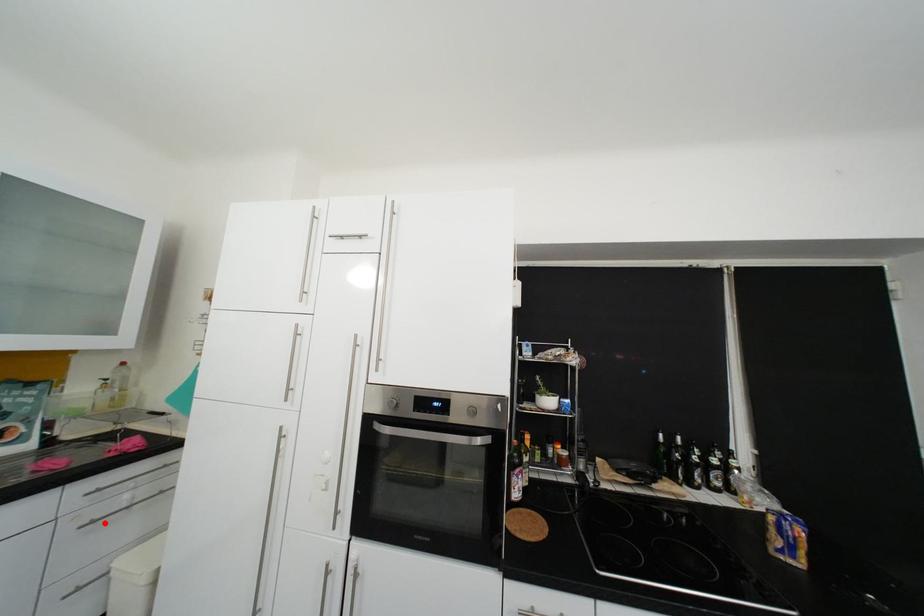
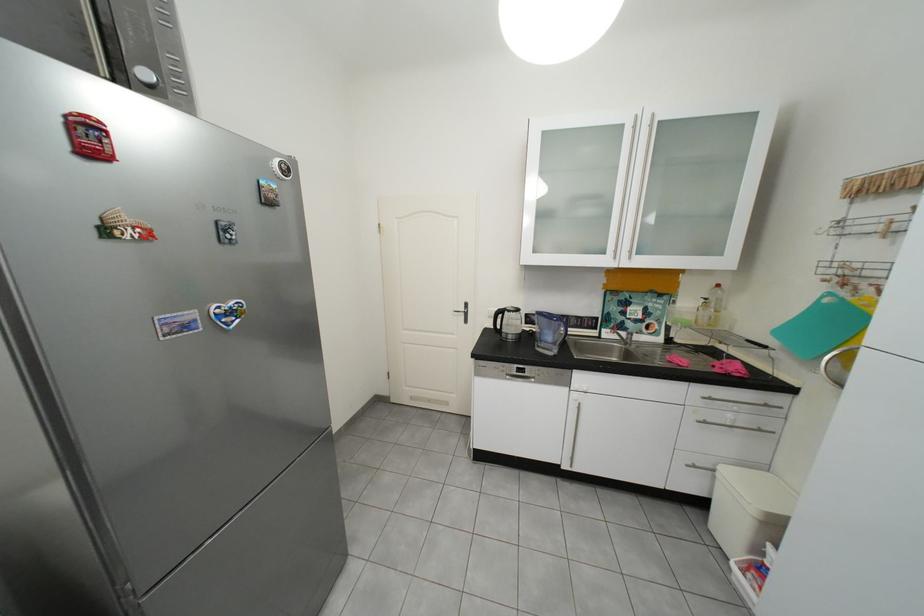
Question: A red point is marked in image1. In image2, is the corresponding 3D point closer to the camera or farther? Reply with the corresponding letter.

Choices:
 (A) The corresponding 3D point is closer.
 (B) The corresponding 3D point is farther.

Answer: (B)